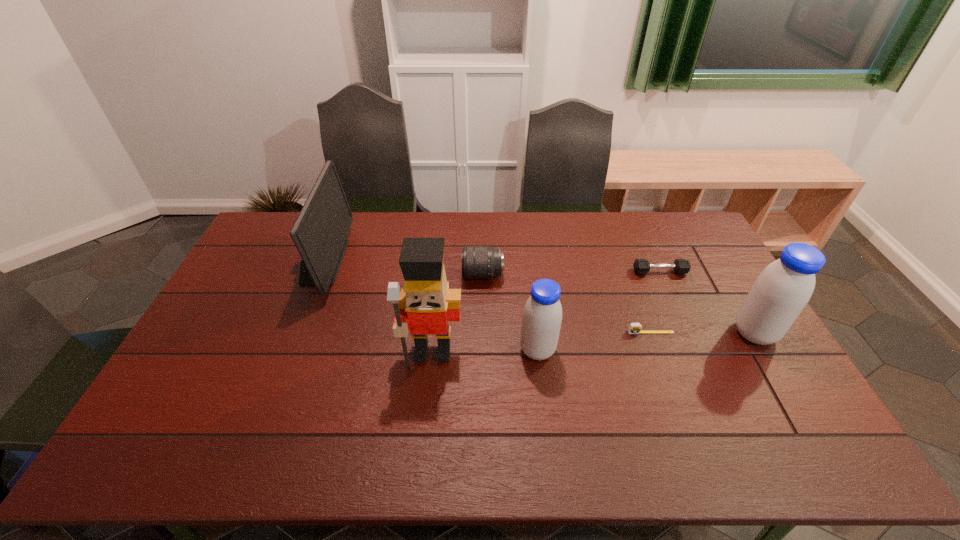
Locate an element on the screen. Image resolution: width=960 pixels, height=540 pixels. the left soya milk is located at coordinates (542, 315).

Identify the location of the fourth object from left to right. The width and height of the screenshot is (960, 540). (542, 315).

Locate an element on the screen. The height and width of the screenshot is (540, 960). the taller soya milk is located at coordinates (781, 291).

Where is `the right soya milk`? This screenshot has height=540, width=960. the right soya milk is located at coordinates (781, 291).

Where is `the third shortest object`? the third shortest object is located at coordinates (478, 262).

Find the location of a particular element. the leftmost object is located at coordinates (319, 233).

In order to click on dumbbell in this screenshot , I will do `click(641, 266)`.

What are the coordinates of `nutcracker` in the screenshot? It's located at (426, 305).

What are the coordinates of `tape measure` in the screenshot? It's located at (x=634, y=328).

Where is `free space located on the right of the fourth object from right to left`? Image resolution: width=960 pixels, height=540 pixels. free space located on the right of the fourth object from right to left is located at coordinates [657, 350].